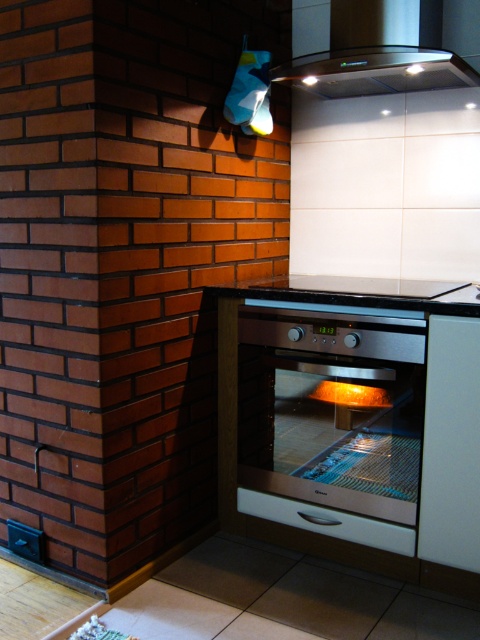
You are a chef preparing to place a large baking tray on the counter. The tray is as big as the satin silver oven at center. Will it fit on the black glass countertop at center?

The satin silver oven at center is bigger than the black glass countertop at center. Since the baking tray is as big as the oven, it will not fit on the black glass countertop at center.

You are a kitchen designer planning to install a new light fixture. The satin black exhaust hood at upper center is at coordinates point 0.081, 0.790. Where should you place the light fixture to ensure it is directly below the exhaust hood?

The satin black exhaust hood at upper center is located at point [379,51], so the light fixture should be placed directly below it at the same x coordinate 0.081 but lower y coordinate.